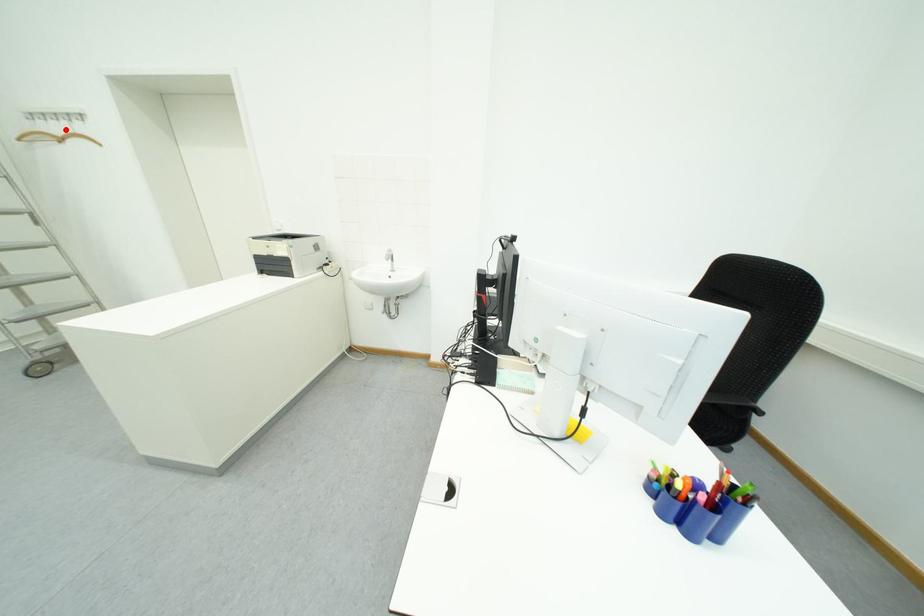
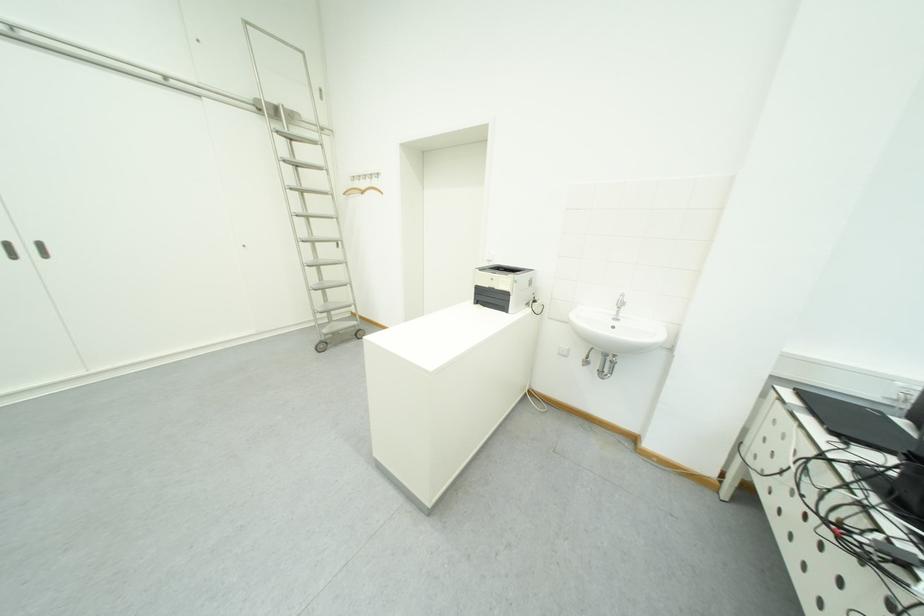
Where in the second image is the point corresponding to the highlighted location from the first image?

(372, 185)